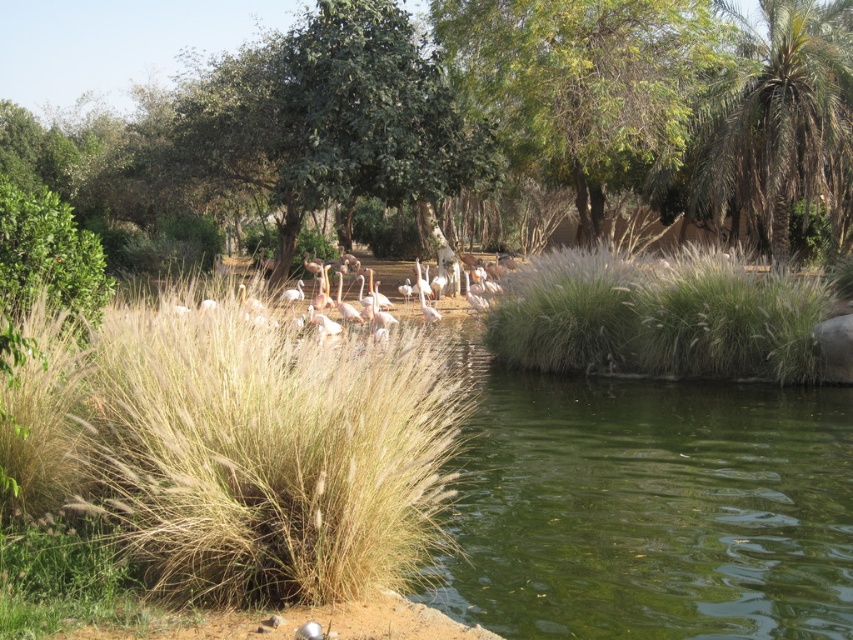
Question: Which object appears closest to the camera in this image?

Choices:
 (A) pink feathered birds at center
 (B) green leafy tree at upper center

Answer: (A)

Question: Which point is farther from the camera taking this photo?

Choices:
 (A) (692, 266)
 (B) (399, 180)

Answer: (B)

Question: Is green leafy tree at upper center further to the viewer compared to green fibrous grass at center?

Choices:
 (A) no
 (B) yes

Answer: (B)

Question: Does green fibrous grass at center appear over pink feathered birds at center?

Choices:
 (A) yes
 (B) no

Answer: (B)

Question: Considering the relative positions of golden textured grass at center and pink feathered birds at center in the image provided, where is golden textured grass at center located with respect to pink feathered birds at center?

Choices:
 (A) above
 (B) below

Answer: (B)

Question: Among these points, which one is farthest from the camera?

Choices:
 (A) (576, 259)
 (B) (764, 243)

Answer: (B)